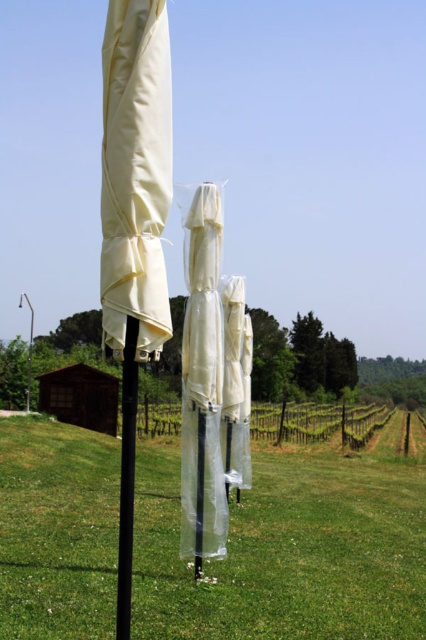
What do you see at coordinates (126, 477) in the screenshot?
I see `black matte pole at center` at bounding box center [126, 477].

The image size is (426, 640). I want to click on black matte pole at center, so click(x=126, y=477).

Is green grass at center shorter than black matte pole at center?

Incorrect, green grass at center's height does not fall short of black matte pole at center's.

Image resolution: width=426 pixels, height=640 pixels. I want to click on green grass at center, so click(x=287, y=550).

Who is lower down, green grass at center or white plastic pole at center?

green grass at center is lower down.

The height and width of the screenshot is (640, 426). What do you see at coordinates (287, 550) in the screenshot?
I see `green grass at center` at bounding box center [287, 550].

At what (x,y) coordinates should I click in order to perform the action: click on green grass at center. Please return your answer as a coordinate pair (x, y). The height and width of the screenshot is (640, 426). Looking at the image, I should click on (287, 550).